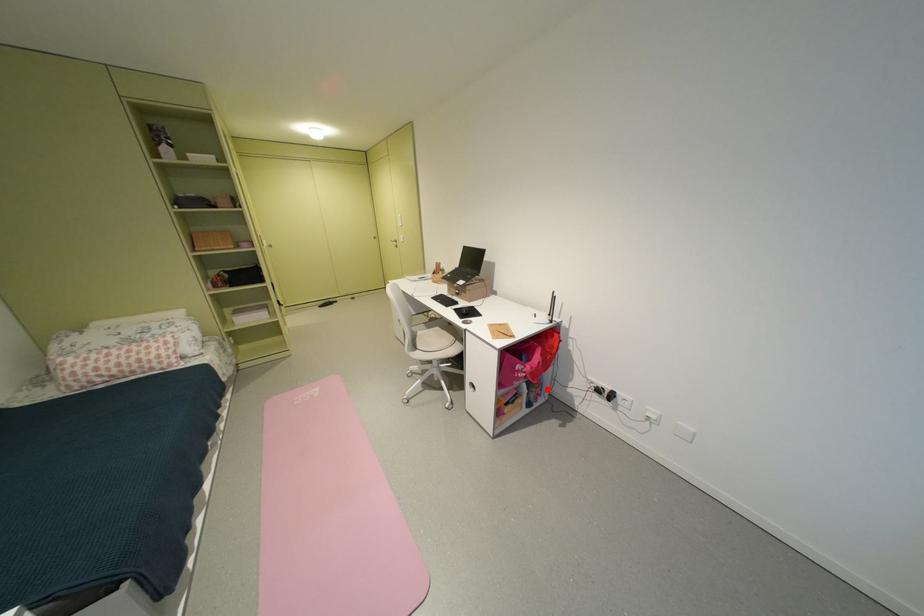
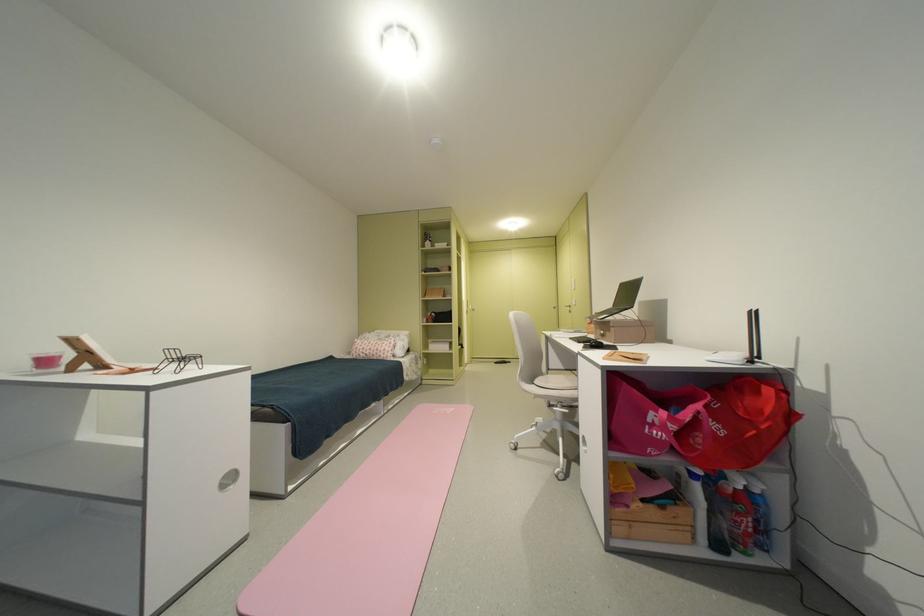
Question: A red point is marked in image1. In image2, is the corresponding 3D point closer to the camera or farther? Reply with the corresponding letter.

Choices:
 (A) The corresponding 3D point is closer.
 (B) The corresponding 3D point is farther.

Answer: (A)